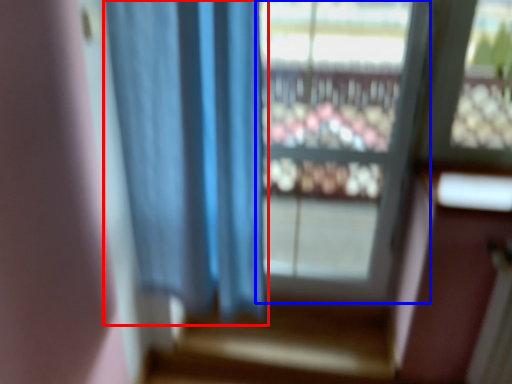
Question: Which object is further to the camera taking this photo, curtain (highlighted by a red box) or window (highlighted by a blue box)?

Choices:
 (A) curtain
 (B) window

Answer: (B)